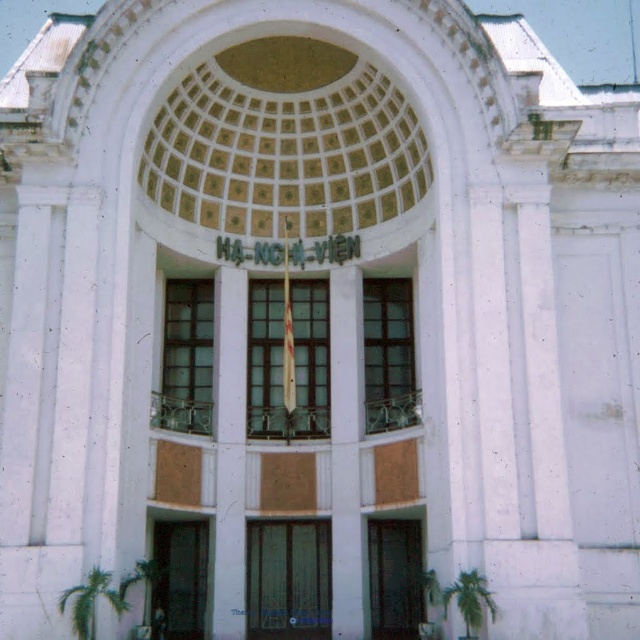
You are a delivery person arriving at the building and need to enter through the main entrance. Which door should you use, the green textured door at center or the matte glass door at lower center?

The green textured door at center is the main entrance because it is located at the center of the building and is part of the prominent arched opening with decorative detailing, while the matte glass door at lower center is shorter and positioned lower, likely serving a different purpose such as a service entrance.

You are a visitor arriving at the building and want to enter through the main entrance. Which door should you use, the green textured door at center or the matte glass door at lower center?

The green textured door at center is to the right of the matte glass door at lower center. Since the green textured door at center is at the center of the building and described as the main entrance, you should use the green textured door at center.